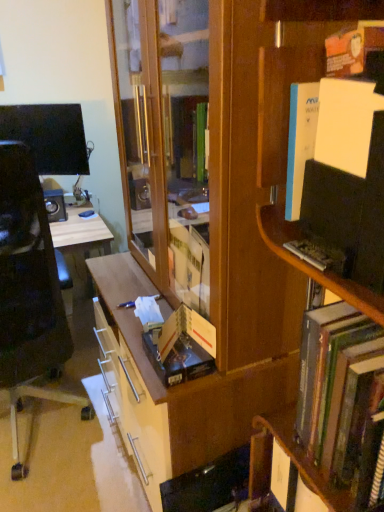
At what (x,y) coordinates should I click in order to perform the action: click on vacant space underneath black plastic chair at left (from a real-world perspective). Please return your answer as a coordinate pair (x, y). The height and width of the screenshot is (512, 384). Looking at the image, I should click on (48, 438).